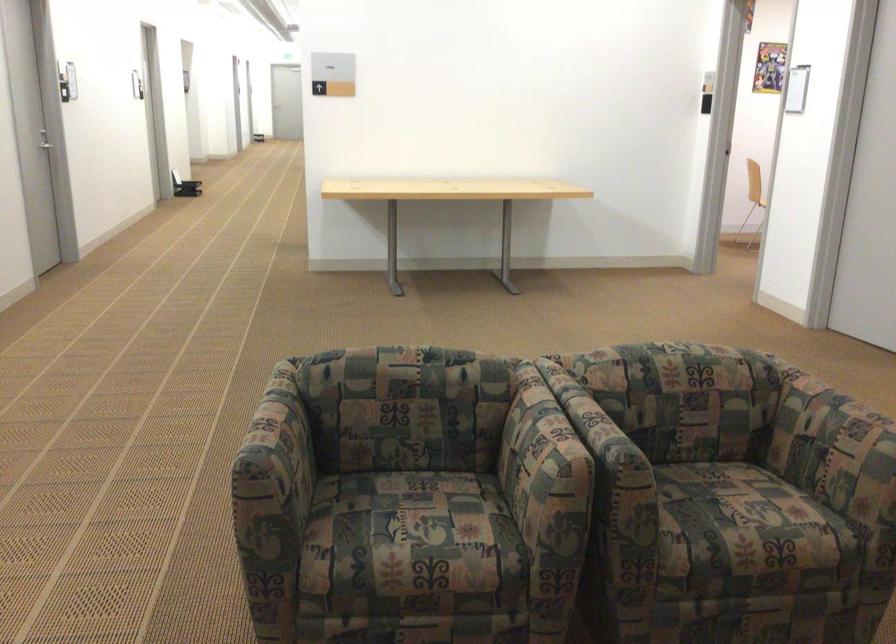
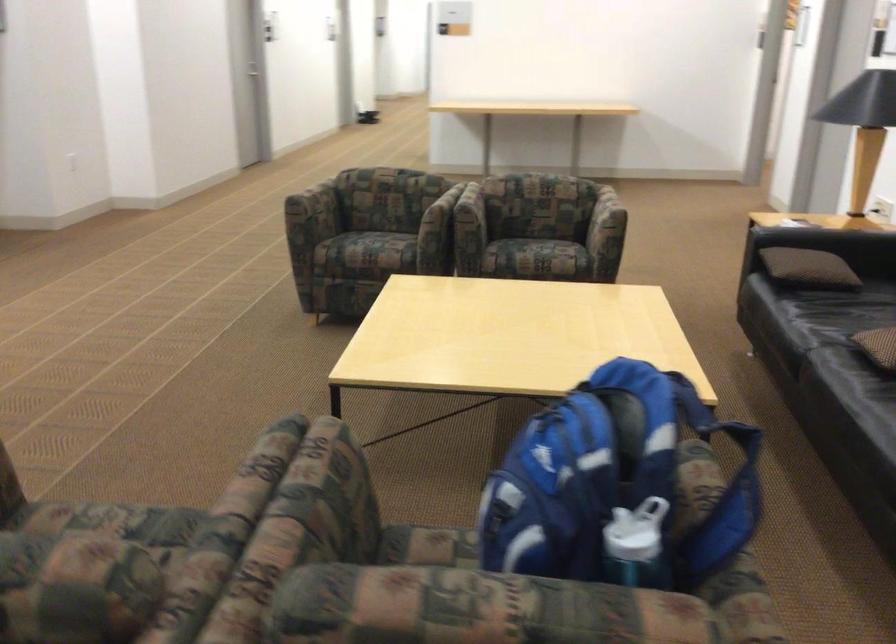
The images are taken continuously from a first-person perspective. In which direction are you moving?

The movement direction of the cameraman is right, backward.